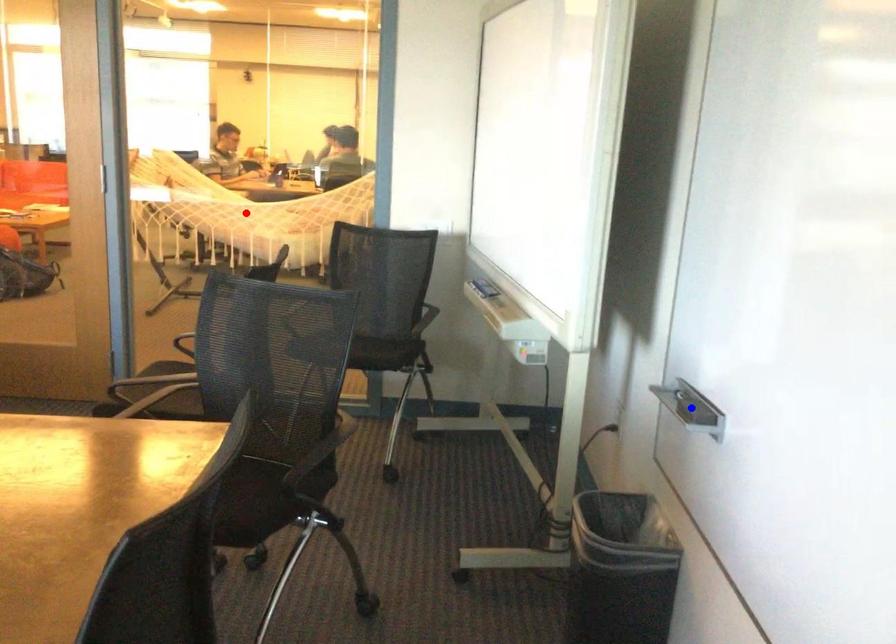
Question: Two points are marked on the image. Which point is closer to the camera?

Choices:
 (A) Blue point is closer.
 (B) Red point is closer.

Answer: (A)